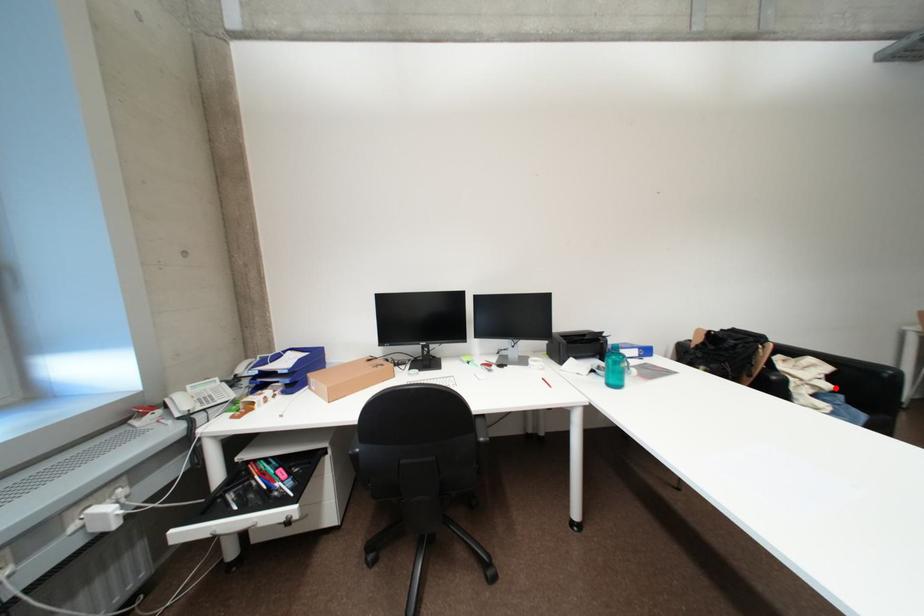
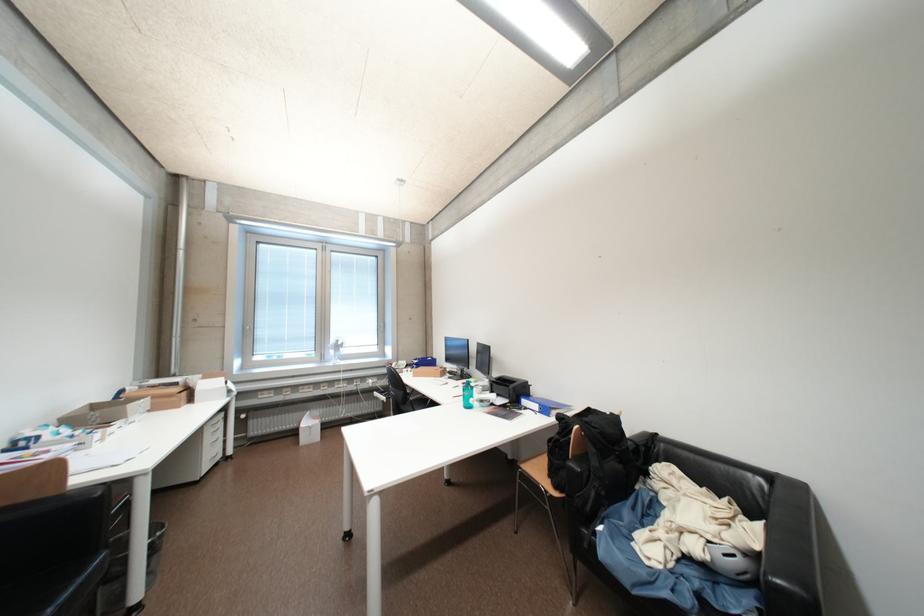
In the second image, find the point that corresponds to the highlighted location in the first image.

(704, 551)